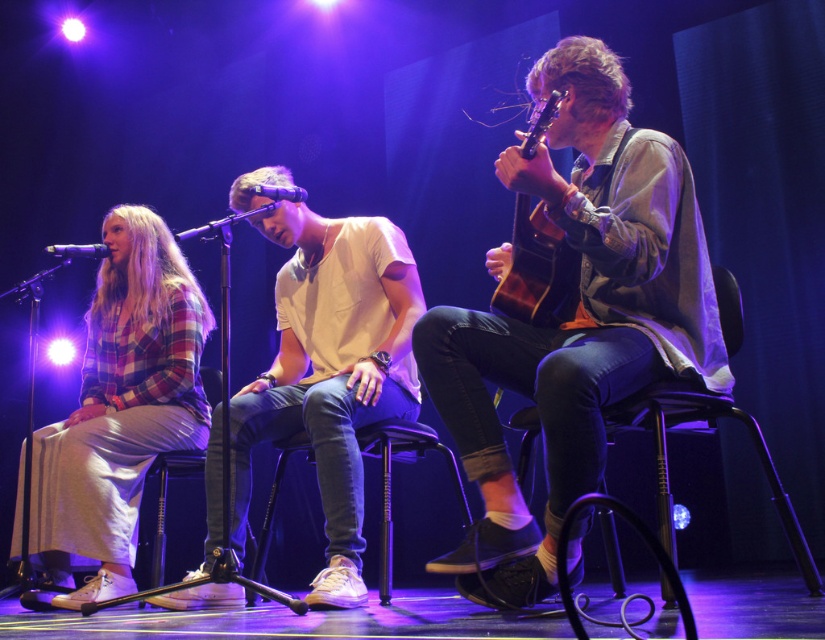
Which is in front, point (564, 458) or point (13, 547)?

Positioned in front is point (564, 458).

Locate an element on the screen. This screenshot has width=825, height=640. denim jeans at center is located at coordinates (574, 317).

Which is behind, point (712, 387) or point (159, 344)?

The point (159, 344) is more distant.

In order to click on denim jeans at center in this screenshot , I will do `click(574, 317)`.

Is white fabric stool at center smaller than matte black microphone at center?

No.

Can you confirm if white fabric stool at center is wider than matte black microphone at center?

Indeed, white fabric stool at center has a greater width compared to matte black microphone at center.

Between point (255, 557) and point (59, 246), which one is positioned in front?

Point (255, 557) is in front.

Locate an element on the screen. white fabric stool at center is located at coordinates (390, 477).

Is black plastic chair at right taller than wooden acoustic guitar at right?

Yes, black plastic chair at right is taller than wooden acoustic guitar at right.

Who is more forward, (748,429) or (563,236)?

Positioned in front is point (563,236).

Locate an element on the screen. The image size is (825, 640). black plastic chair at right is located at coordinates (712, 429).